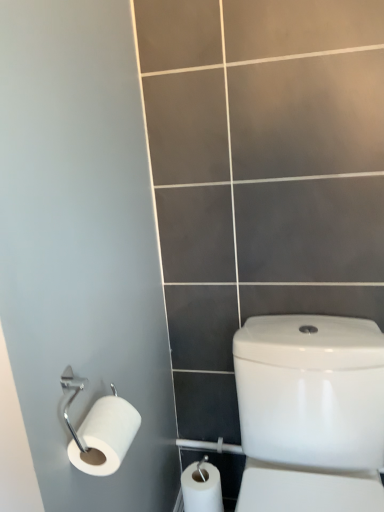
Find the location of a particular element. white matte toilet paper at left is located at coordinates (105, 436).

The height and width of the screenshot is (512, 384). Describe the element at coordinates (105, 436) in the screenshot. I see `white matte toilet paper at left` at that location.

What is the approximate width of white glossy water tank at right?

It is 65.13 centimeters.

Describe the element at coordinates (311, 391) in the screenshot. I see `white glossy water tank at right` at that location.

In order to click on white glossy water tank at right in this screenshot , I will do `click(311, 391)`.

The height and width of the screenshot is (512, 384). In order to click on white matte toilet paper at left in this screenshot , I will do `click(105, 436)`.

Considering the relative positions of white glossy water tank at right and white matte toilet paper at left in the image provided, is white glossy water tank at right to the left of white matte toilet paper at left from the viewer's perspective?

No.

Which is in front, white glossy water tank at right or white matte toilet paper at left?

white glossy water tank at right is in front.

Which is in front, point (362, 433) or point (104, 436)?

The point (104, 436) is closer to the camera.

From the image's perspective, is white glossy water tank at right under white matte toilet paper at left?

Indeed, from the image's perspective, white glossy water tank at right is shown beneath white matte toilet paper at left.

From the picture: From a real-world perspective, who is located higher, white glossy water tank at right or white matte toilet paper at left?

In real-world perspective, white matte toilet paper at left is above.

Between white glossy water tank at right and white matte toilet paper at left, which one has smaller width?

white matte toilet paper at left.

Who is taller, white glossy water tank at right or white matte toilet paper at left?

white glossy water tank at right is taller.

Does white glossy water tank at right have a larger size compared to white matte toilet paper at left?

Indeed, white glossy water tank at right has a larger size compared to white matte toilet paper at left.

Which is correct: white glossy water tank at right is inside white matte toilet paper at left, or outside of it?

white glossy water tank at right cannot be found inside white matte toilet paper at left.

Can you see white glossy water tank at right touching white matte toilet paper at left?

They are not placed beside each other.

Does white glossy water tank at right turn towards white matte toilet paper at left?

No, white glossy water tank at right does not turn towards white matte toilet paper at left.

How different are the orientations of white glossy water tank at right and white matte toilet paper at left in degrees?

The angular difference between white glossy water tank at right and white matte toilet paper at left is 89.1 degrees.

The width and height of the screenshot is (384, 512). What are the coordinates of `toilet paper located above the white glossy water tank at right (from the image's perspective)` in the screenshot? It's located at (105, 436).

Considering the relative positions of white matte toilet paper at left and white glossy water tank at right in the image provided, is white matte toilet paper at left to the right of white glossy water tank at right from the viewer's perspective?

No, white matte toilet paper at left is not to the right of white glossy water tank at right.

In the scene shown: Between white matte toilet paper at left and white glossy water tank at right, which one is positioned in front?

white glossy water tank at right is in front.

Does point (103, 431) appear closer or farther from the camera than point (298, 372)?

Clearly, point (103, 431) is closer to the camera than point (298, 372).

From the image's perspective, is white matte toilet paper at left under white glossy water tank at right?

Actually, white matte toilet paper at left appears above white glossy water tank at right in the image.

From a real-world perspective, between white matte toilet paper at left and white glossy water tank at right, who is vertically higher?

From a 3D spatial view, white matte toilet paper at left is above.

Considering the relative sizes of white matte toilet paper at left and white glossy water tank at right in the image provided, is white matte toilet paper at left wider than white glossy water tank at right?

Incorrect, the width of white matte toilet paper at left does not surpass that of white glossy water tank at right.

Is white matte toilet paper at left taller or shorter than white glossy water tank at right?

white matte toilet paper at left is shorter than white glossy water tank at right.

Between white matte toilet paper at left and white glossy water tank at right, which one has larger size?

white glossy water tank at right.

Choose the correct answer: Is white matte toilet paper at left inside white glossy water tank at right or outside it?

white matte toilet paper at left exists outside the volume of white glossy water tank at right.

Is white matte toilet paper at left touching white glossy water tank at right?

There is a gap between white matte toilet paper at left and white glossy water tank at right.

Looking at this image, is white matte toilet paper at left oriented away from white glossy water tank at right?

No, white matte toilet paper at left's orientation is not away from white glossy water tank at right.

What's the angular difference between white matte toilet paper at left and white glossy water tank at right's facing directions?

The angle between the facing direction of white matte toilet paper at left and the facing direction of white glossy water tank at right is 89.1 degrees.

Locate an element on the screen. toilet paper lying behind the white glossy water tank at right is located at coordinates click(x=105, y=436).

Find the location of a particular element. water tank on the right of the white matte toilet paper at left is located at coordinates (311, 391).

At what (x,y) coordinates should I click in order to perform the action: click on water tank that appears below the white matte toilet paper at left (from the image's perspective). Please return your answer as a coordinate pair (x, y). Looking at the image, I should click on (311, 391).